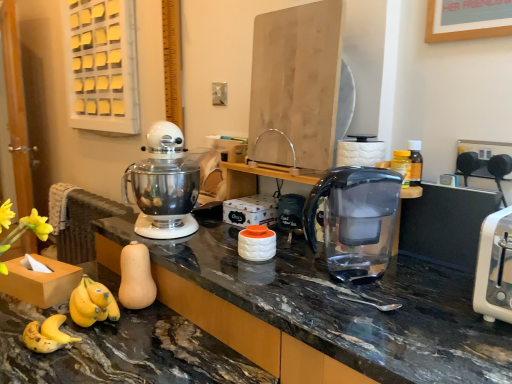
Question: Can you confirm if matte black jar at center is positioned to the left of transparent plastic water filter pitcher at center?

Choices:
 (A) yes
 (B) no

Answer: (A)

Question: Is matte black jar at center positioned with its back to transparent plastic water filter pitcher at center?

Choices:
 (A) no
 (B) yes

Answer: (A)

Question: Considering the relative sizes of matte black jar at center and transparent plastic water filter pitcher at center in the image provided, is matte black jar at center shorter than transparent plastic water filter pitcher at center?

Choices:
 (A) no
 (B) yes

Answer: (B)

Question: Is matte black jar at center smaller than transparent plastic water filter pitcher at center?

Choices:
 (A) no
 (B) yes

Answer: (B)

Question: Can you confirm if matte black jar at center is wider than transparent plastic water filter pitcher at center?

Choices:
 (A) yes
 (B) no

Answer: (B)

Question: From a real-world perspective, is matte black jar at center on transparent plastic water filter pitcher at center?

Choices:
 (A) no
 (B) yes

Answer: (A)

Question: Considering the relative sizes of satin silver mixer at center and transparent plastic water filter pitcher at center in the image provided, is satin silver mixer at center bigger than transparent plastic water filter pitcher at center?

Choices:
 (A) no
 (B) yes

Answer: (B)

Question: From the image's perspective, is satin silver mixer at center below transparent plastic water filter pitcher at center?

Choices:
 (A) no
 (B) yes

Answer: (A)

Question: From the image's perspective, does satin silver mixer at center appear higher than transparent plastic water filter pitcher at center?

Choices:
 (A) yes
 (B) no

Answer: (A)

Question: Does satin silver mixer at center come behind transparent plastic water filter pitcher at center?

Choices:
 (A) yes
 (B) no

Answer: (A)

Question: Is satin silver mixer at center smaller than transparent plastic water filter pitcher at center?

Choices:
 (A) no
 (B) yes

Answer: (A)

Question: Is satin silver mixer at center closer to camera compared to transparent plastic water filter pitcher at center?

Choices:
 (A) no
 (B) yes

Answer: (A)

Question: Is transparent plastic water filter pitcher at center shorter than marble black countertop at lower left?

Choices:
 (A) no
 (B) yes

Answer: (B)